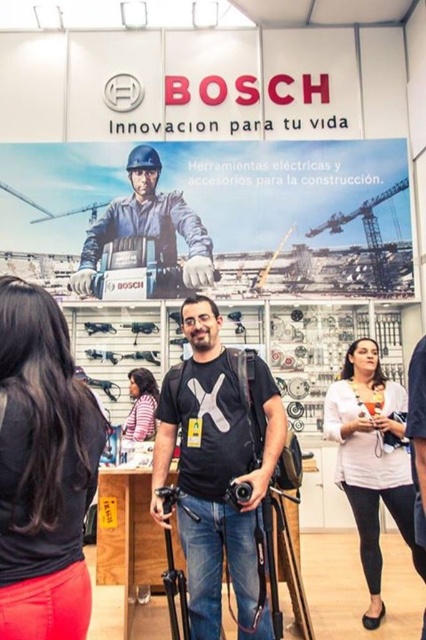
At what (x,y) coordinates should I click in order to perform the action: click on black leather jacket at upper left. Please return your answer as a coordinate pair (x, y). The image size is (426, 640). Looking at the image, I should click on (43, 468).

You are a GUI agent. You are given a task and a screenshot of the screen. Output one action in this format:
    pyautogui.click(x=<x>, y=<y>)
    Task: Click on the black leather jacket at upper left
    This screenshot has height=640, width=426.
    Given the screenshot: What is the action you would take?
    pyautogui.click(x=43, y=468)

You are a GUI agent. You are given a task and a screenshot of the screen. Output one action in this format:
    pyautogui.click(x=<x>, y=<y>)
    Task: Click on the black leather jacket at upper left
    The image size is (426, 640).
    Given the screenshot: What is the action you would take?
    pyautogui.click(x=43, y=468)

Which is below, black matte t-shirt at center or matte black helmet at upper center?

black matte t-shirt at center is lower down.

Is black matte t-shirt at center positioned before matte black helmet at upper center?

Yes, it is.

This screenshot has height=640, width=426. Identify the location of black matte t-shirt at center. (215, 468).

Which is above, white matte shirt at lower right or pink fabric shirt at lower left?

pink fabric shirt at lower left is above.

Can you confirm if white matte shirt at lower right is taller than pink fabric shirt at lower left?

Correct, white matte shirt at lower right is much taller as pink fabric shirt at lower left.

What do you see at coordinates (371, 460) in the screenshot? I see `white matte shirt at lower right` at bounding box center [371, 460].

Identify the location of white matte shirt at lower right. This screenshot has height=640, width=426. (371, 460).